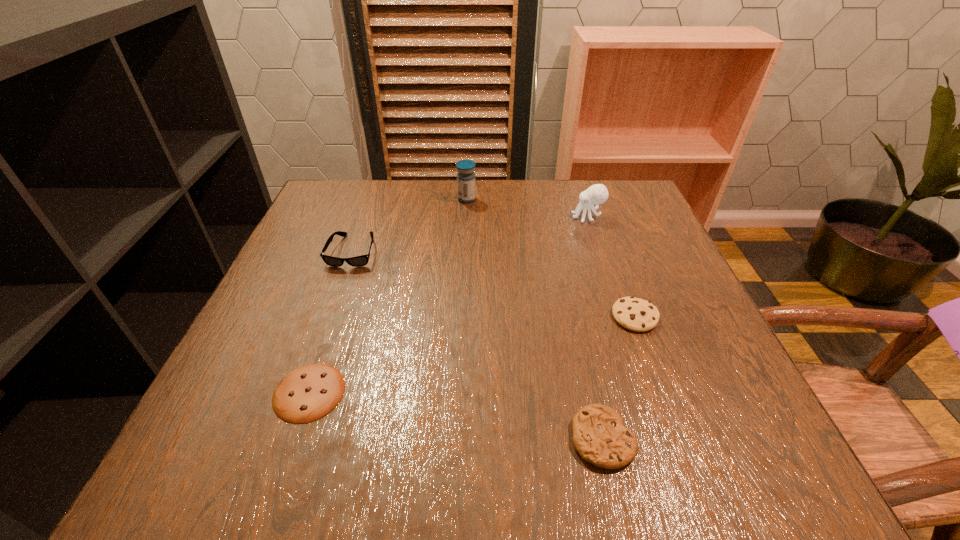
The height and width of the screenshot is (540, 960). I want to click on cookie present at the left edge, so click(308, 393).

Identify the location of octopus positioned at the right edge. (596, 194).

Locate an element on the screen. Image resolution: width=960 pixels, height=540 pixels. cookie that is at the right edge is located at coordinates (635, 314).

Where is `object at the near left corner`? object at the near left corner is located at coordinates (308, 393).

Identify the location of object located at the far right corner. (596, 194).

Find the location of a particular element. The width and height of the screenshot is (960, 540). vacant space at the far edge of the desktop is located at coordinates (456, 192).

At what (x,y) coordinates should I click in order to perform the action: click on free space at the near edge. Please return your answer as a coordinate pair (x, y). The width and height of the screenshot is (960, 540). Looking at the image, I should click on (503, 432).

Find the location of a particular element. Image resolution: width=960 pixels, height=540 pixels. vacant space at the left edge of the desktop is located at coordinates (227, 399).

Find the location of `blank area at the right edge`. blank area at the right edge is located at coordinates (687, 307).

This screenshot has width=960, height=540. What are the coordinates of `free space at the far left corner of the desktop` in the screenshot? It's located at (353, 200).